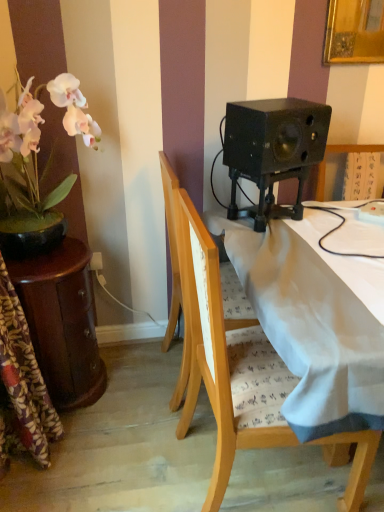
Question: Looking at their shapes, would you say wooden chair at center, the 1th chair positioned from the front, is wider or thinner than wooden chair at center, which ranks as the first chair in back-to-front order?

Choices:
 (A) wide
 (B) thin

Answer: (B)

Question: In the image, is wooden chair at center, the 1th chair positioned from the front, on the left side or the right side of wooden chair at center, which ranks as the first chair in back-to-front order?

Choices:
 (A) left
 (B) right

Answer: (B)

Question: Which is nearer to the wooden chair at center, the 2th chair viewed from the front?

Choices:
 (A) pink matte flower pot at left
 (B) black matte speaker at upper right
 (C) mahogany wooden side table at left
 (D) wooden chair at center, the 2th chair viewed from the back

Answer: (D)

Question: Which of these objects is positioned closest to the wooden chair at center, the 1th chair positioned from the front?

Choices:
 (A) pink matte flower pot at left
 (B) wooden chair at center, which ranks as the first chair in back-to-front order
 (C) mahogany wooden side table at left
 (D) black matte speaker at upper right

Answer: (B)